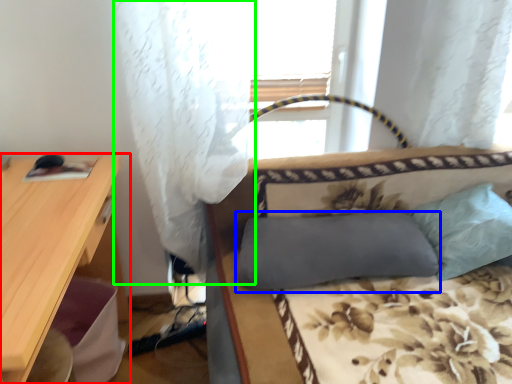
Question: Which object is the closest to the desk (highlighted by a red box)? Choose among these: pillow (highlighted by a blue box) or curtain (highlighted by a green box).

Choices:
 (A) pillow
 (B) curtain

Answer: (B)